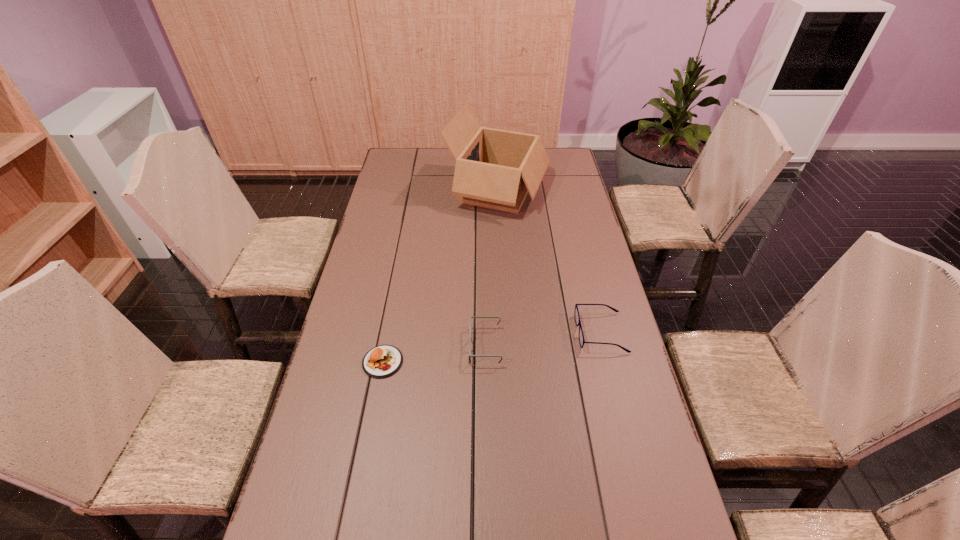
I want to click on free space located 0.350m on the front-facing side of the right spectacles, so click(459, 333).

The width and height of the screenshot is (960, 540). In order to click on free spot located 0.260m on the front-facing side of the right spectacles in this screenshot , I will do `click(489, 333)`.

I want to click on free space located on the front-facing side of the right spectacles, so click(x=523, y=333).

Where is `free space located on the right of the shortest object`? free space located on the right of the shortest object is located at coordinates (468, 362).

What are the coordinates of `object located at the far edge` in the screenshot? It's located at (496, 169).

You are a GUI agent. You are given a task and a screenshot of the screen. Output one action in this format:
    pyautogui.click(x=<x>, y=<y>)
    Task: Click on the object located at the left edge
    
    Given the screenshot: What is the action you would take?
    pyautogui.click(x=382, y=361)

At what (x,y) coordinates should I click in order to perform the action: click on box that is at the right edge. Please return your answer as a coordinate pair (x, y). The height and width of the screenshot is (540, 960). Looking at the image, I should click on (496, 169).

Where is `spectacles located at the right edge`? The width and height of the screenshot is (960, 540). spectacles located at the right edge is located at coordinates (576, 313).

Find the location of a particular element. Image resolution: width=960 pixels, height=540 pixels. object situated at the far right corner is located at coordinates (496, 169).

At what (x,y) coordinates should I click in order to perform the action: click on free space at the left edge of the desktop. Please return your answer as a coordinate pair (x, y). Looking at the image, I should click on (387, 281).